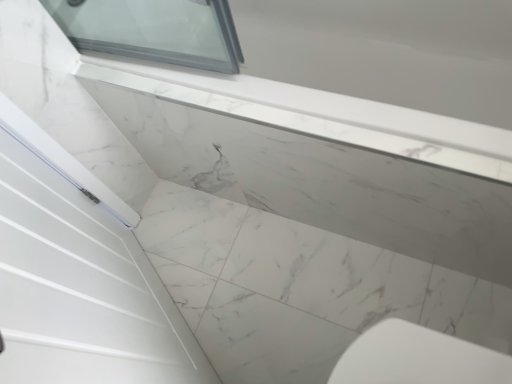
Where is `free space in front of white marble window sill at upper center`? free space in front of white marble window sill at upper center is located at coordinates (335, 291).